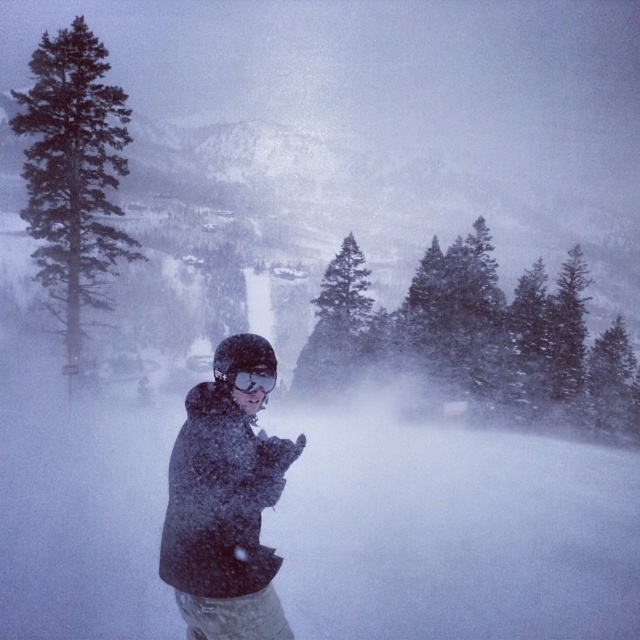
Question: Does dark gray fleece jacket at center appear on the right side of dark green textured pine tree at left?

Choices:
 (A) yes
 (B) no

Answer: (A)

Question: Which point is closer to the camera?

Choices:
 (A) dark green textured pine tree at left
 (B) dark gray fleece jacket at center

Answer: (B)

Question: Which of the following is the closest to the observer?

Choices:
 (A) dark green textured pine tree at left
 (B) dark gray fleece jacket at center

Answer: (B)

Question: Can you confirm if dark gray fleece jacket at center is positioned below dark green textured pine tree at left?

Choices:
 (A) no
 (B) yes

Answer: (B)

Question: Among these objects, which one is farthest from the camera?

Choices:
 (A) matte black goggles at center
 (B) dark green textured pine tree at left
 (C) dark gray fleece jacket at center

Answer: (B)

Question: Is dark gray fleece jacket at center below dark green textured pine tree at left?

Choices:
 (A) yes
 (B) no

Answer: (A)